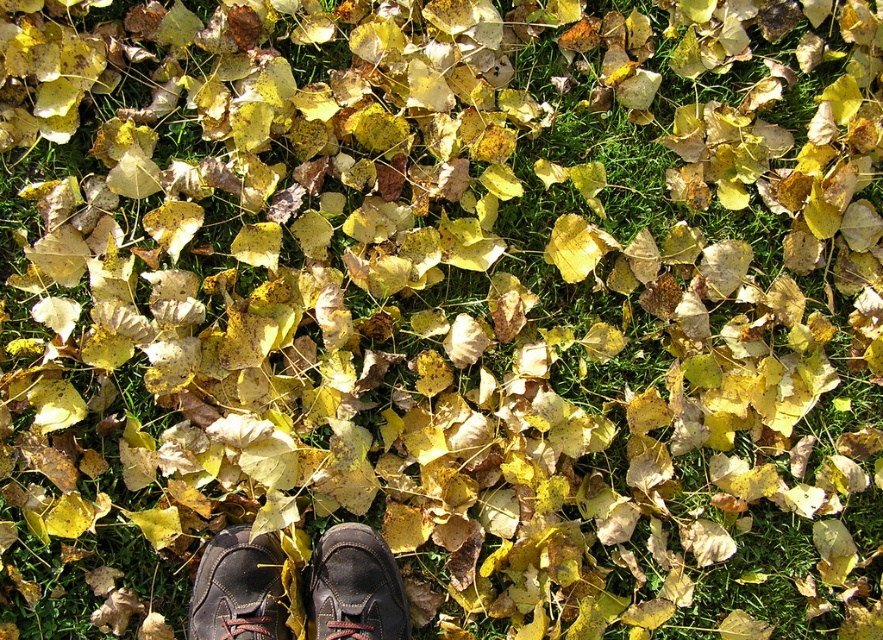
Which is above, matte black shoe at center or dark brown leather shoe at center?

dark brown leather shoe at center is above.

The image size is (883, 640). What do you see at coordinates (355, 586) in the screenshot?
I see `matte black shoe at center` at bounding box center [355, 586].

This screenshot has width=883, height=640. Find the location of `matte black shoe at center`. matte black shoe at center is located at coordinates (355, 586).

Can you confirm if black leather shoes at center is smaller than matte black shoe at center?

No, black leather shoes at center is not smaller than matte black shoe at center.

Does black leather shoes at center have a lesser width compared to matte black shoe at center?

No.

Does point (375, 579) lie in front of point (372, 620)?

That is False.

You are a GUI agent. You are given a task and a screenshot of the screen. Output one action in this format:
    pyautogui.click(x=<x>, y=<y>)
    Task: Click on the black leather shoes at center
    The width and height of the screenshot is (883, 640).
    Given the screenshot: What is the action you would take?
    pyautogui.click(x=355, y=586)

You are a GUI agent. You are given a task and a screenshot of the screen. Output one action in this format:
    pyautogui.click(x=<x>, y=<y>)
    Task: Click on the black leather shoes at center
    This screenshot has height=640, width=883.
    Given the screenshot: What is the action you would take?
    pyautogui.click(x=355, y=586)

Does black leather shoes at center appear on the right side of dark brown leather shoe at center?

Indeed, black leather shoes at center is positioned on the right side of dark brown leather shoe at center.

Is point (255, 548) closer to camera compared to point (192, 621)?

That is False.

Where is `black leather shoes at center`? black leather shoes at center is located at coordinates (355, 586).